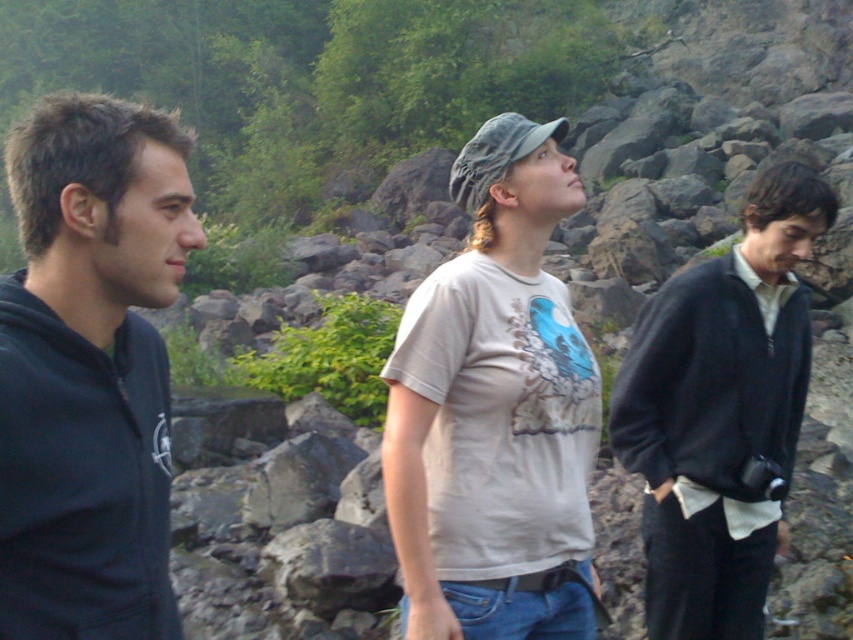
Question: Is light gray cotton t-shirt at center thinner than dark blue fleece at right?

Choices:
 (A) no
 (B) yes

Answer: (B)

Question: Which object is closer to the camera taking this photo?

Choices:
 (A) light gray cotton t-shirt at center
 (B) light beige t-shirt at center
 (C) dark blue fleece at right

Answer: (A)

Question: Is dark blue hoodie at left positioned in front of dark blue fleece at right?

Choices:
 (A) no
 (B) yes

Answer: (B)

Question: Considering the relative positions of dark blue hoodie at left and dark blue fleece at right in the image provided, where is dark blue hoodie at left located with respect to dark blue fleece at right?

Choices:
 (A) above
 (B) below

Answer: (A)

Question: Which point is farther to the camera?

Choices:
 (A) (538, 625)
 (B) (764, 296)

Answer: (B)

Question: Which object is the farthest from the light gray cotton t-shirt at center?

Choices:
 (A) dark blue hoodie at left
 (B) light beige t-shirt at center
 (C) dark blue fleece at right

Answer: (C)